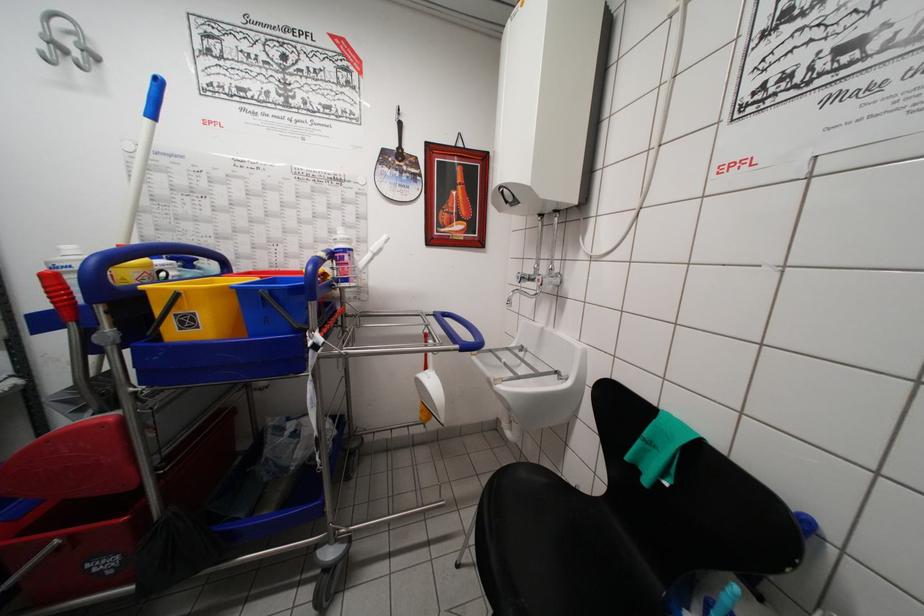
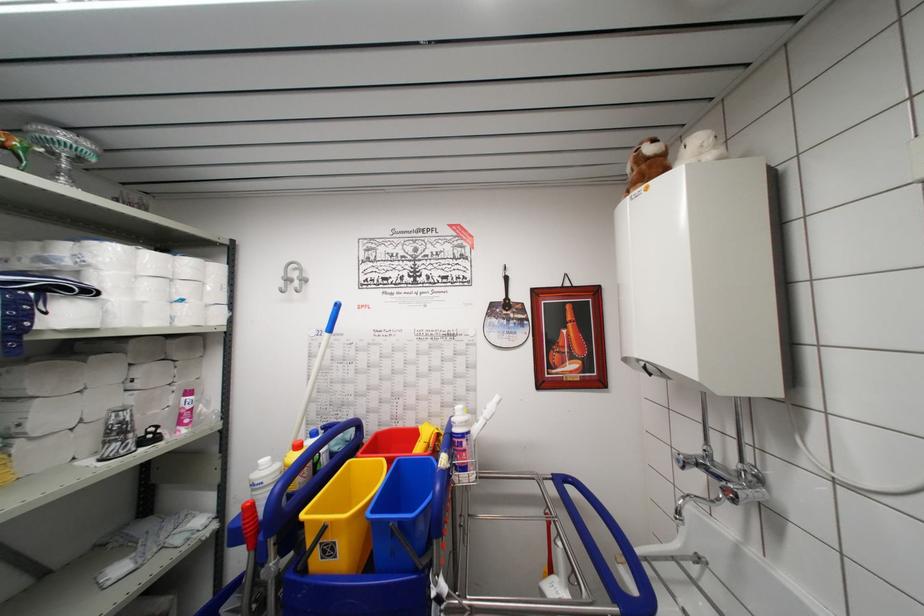
In the second image, find the point that corresponds to point 512,306 in the first image.

(681, 517)